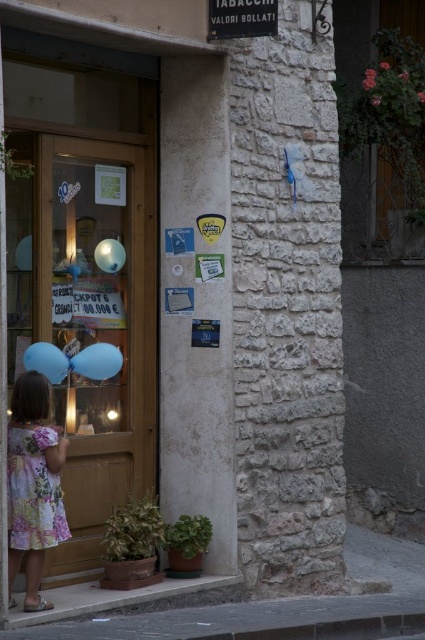
Question: Observing the image, what is the correct spatial positioning of floral cotton dress at lower left in reference to blue matte balloon at left?

Choices:
 (A) right
 (B) left

Answer: (B)

Question: Which point is farther from the camera taking this photo?

Choices:
 (A) (98, 248)
 (B) (19, 248)
 (C) (223, 3)

Answer: (A)

Question: Is floral cotton dress at lower left bigger than light blue rubber balloon at left?

Choices:
 (A) yes
 (B) no

Answer: (A)

Question: Does wooden door at center have a larger size compared to light blue rubber balloon at left?

Choices:
 (A) yes
 (B) no

Answer: (A)

Question: Which point is closer to the camera taking this photo?

Choices:
 (A) (22, 266)
 (B) (59, 352)
 (C) (113, 241)
 (D) (108, 358)

Answer: (B)

Question: Estimate the real-world distances between objects in this image. Which object is farther from the matte blue balloon at left?

Choices:
 (A) floral cotton dress at lower left
 (B) blue matte balloon at left
 (C) black metal sign at upper center
 (D) wooden door at center

Answer: (C)